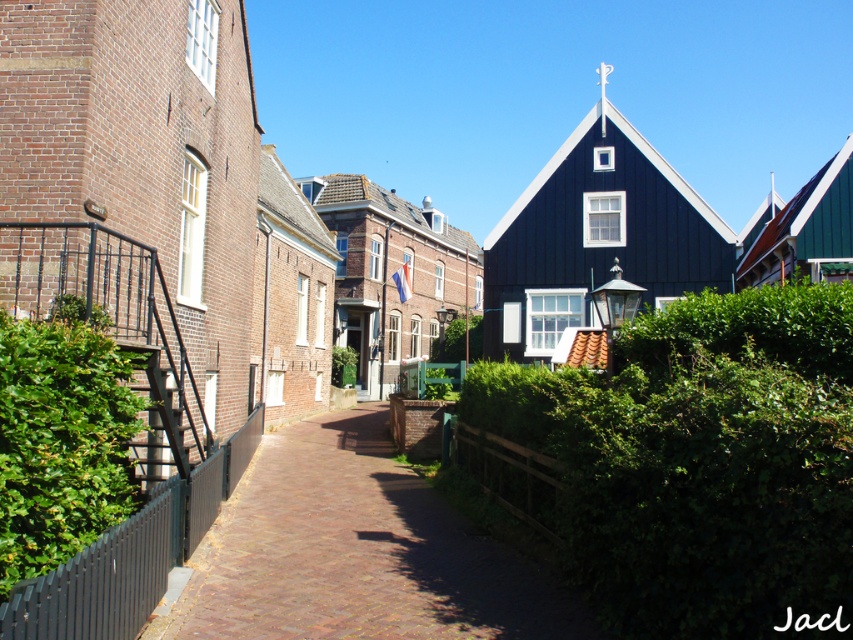
Question: Among these points, which one is farthest from the camera?

Choices:
 (A) (769, 410)
 (B) (32, 561)

Answer: (A)

Question: Which point is closer to the camera?

Choices:
 (A) green leafy hedge at left
 (B) brick paved path at center

Answer: (A)

Question: Does brick paved path at center come behind brick textured church at center?

Choices:
 (A) yes
 (B) no

Answer: (B)

Question: Can you confirm if green leafy hedge at center is positioned to the left of brick paved path at center?

Choices:
 (A) no
 (B) yes

Answer: (A)

Question: Is green leafy hedge at center above brick textured church at center?

Choices:
 (A) yes
 (B) no

Answer: (B)

Question: Which of these objects is positioned closest to the green leafy hedge at left?

Choices:
 (A) brick textured church at center
 (B) green leafy hedge at center
 (C) black wooden house at center
 (D) brick paved path at center

Answer: (D)